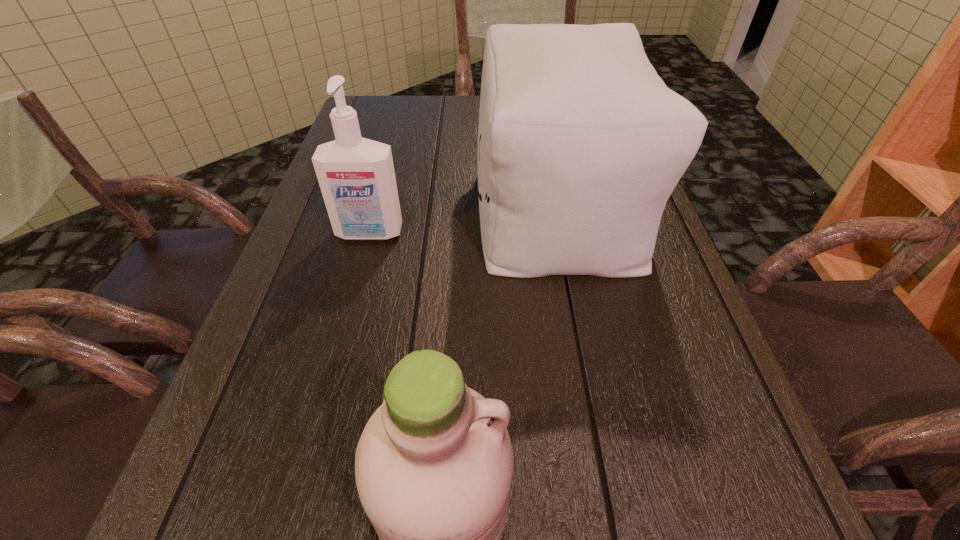
Identify the location of free space at the right edge. (667, 260).

In the image, there is a desktop. Identify the location of vacant space at the far left corner. The height and width of the screenshot is (540, 960). (359, 119).

The width and height of the screenshot is (960, 540). What are the coordinates of `empty space between the farther cleansing agent and the cushion` in the screenshot? It's located at (463, 219).

The width and height of the screenshot is (960, 540). Identify the location of free space between the cushion and the farther cleansing agent. (463, 219).

This screenshot has height=540, width=960. In order to click on free spot between the cushion and the left cleansing agent in this screenshot , I will do `click(463, 219)`.

This screenshot has height=540, width=960. In order to click on object that stands as the second closest to the nearest object in this screenshot , I will do `click(356, 175)`.

Select which object appears as the closest to the nearer cleansing agent. Please provide its 2D coordinates. Your answer should be formatted as a tuple, i.e. [(x, y)], where the tuple contains the x and y coordinates of a point satisfying the conditions above.

[(580, 143)]

Where is `free space that satisfies the following two spatial constraints: 1. on the side of the cushion with the smiley face; 2. on the front label of the farther cleansing agent`? The width and height of the screenshot is (960, 540). free space that satisfies the following two spatial constraints: 1. on the side of the cushion with the smiley face; 2. on the front label of the farther cleansing agent is located at coordinates (562, 233).

You are a GUI agent. You are given a task and a screenshot of the screen. Output one action in this format:
    pyautogui.click(x=<x>, y=<y>)
    Task: Click on the free region that satisfies the following two spatial constraints: 1. on the side of the cushion with the smiley face; 2. on the front label of the farther cleansing agent
    This screenshot has height=540, width=960.
    Given the screenshot: What is the action you would take?
    pyautogui.click(x=562, y=233)

You are a GUI agent. You are given a task and a screenshot of the screen. Output one action in this format:
    pyautogui.click(x=<x>, y=<y>)
    Task: Click on the vacant space that satisfies the following two spatial constraints: 1. on the side of the cushion with the smiley face; 2. on the front label of the left cleansing agent
    The height and width of the screenshot is (540, 960).
    Given the screenshot: What is the action you would take?
    pyautogui.click(x=562, y=233)